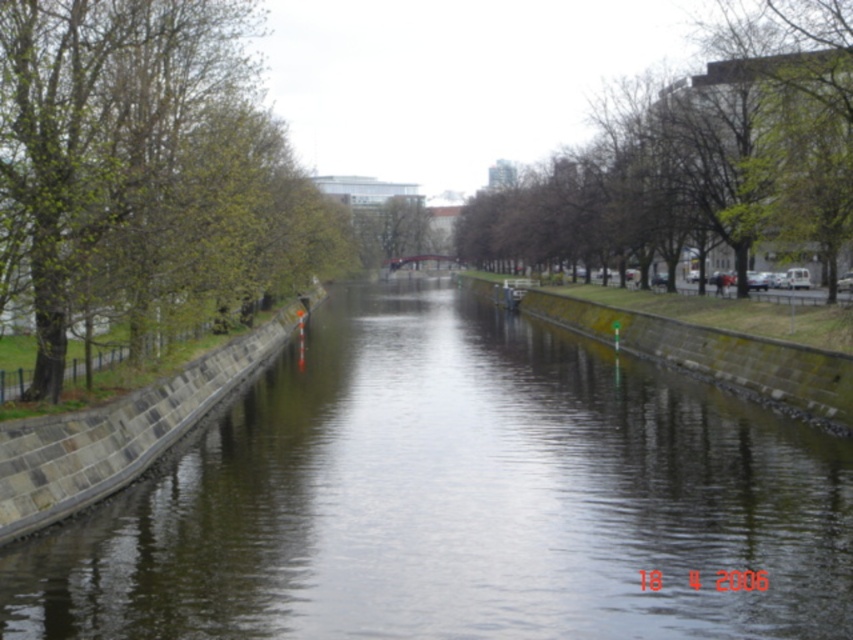
You are standing at the point marked by the coordinates point (457, 499) in the canal scene. What type of surface are you currently standing on?

The point (457, 499) marks smooth concrete river at center, so you are standing on a smooth concrete surface.

You are standing at the point with coordinates point (766, 26) and want to walk towards the point (398, 531). Based on the scene, will you be moving towards the trees with green foliage or the bare trees?

Point (398, 531) is in front of point (766, 26). Since the trees on the left have green foliage and those on the right are bare, moving towards point (398, 531) would mean walking towards the trees with green foliage.

You are standing at the edge of the canal and want to know which object is taller between the smooth concrete river at center and the green leafy tree at left. Can you determine this based on the scene?

The smooth concrete river at center has a lesser height compared to green leafy tree at left, so the green leafy tree at left is taller.